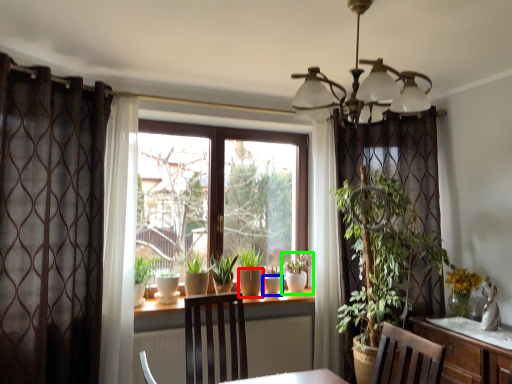
Question: Which object is positioned closest to flowerpot (highlighted by a red box)? Select from flowerpot (highlighted by a blue box) and houseplant (highlighted by a green box).

Choices:
 (A) flowerpot
 (B) houseplant

Answer: (A)